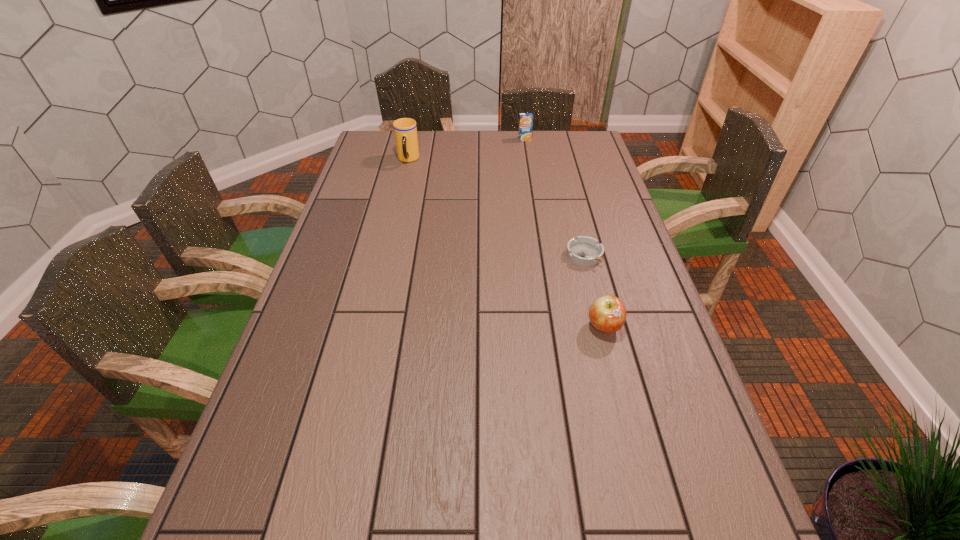
Where is `the tallest object`? This screenshot has width=960, height=540. the tallest object is located at coordinates (405, 129).

Locate an element on the screen. This screenshot has height=540, width=960. the leftmost object is located at coordinates (405, 129).

Find the location of a particular element. The width and height of the screenshot is (960, 540). orange_juice is located at coordinates (525, 119).

Where is `the second object from left to right`? This screenshot has height=540, width=960. the second object from left to right is located at coordinates (525, 119).

Locate an element on the screen. This screenshot has height=540, width=960. the nearest object is located at coordinates (607, 314).

Where is `the third tallest object`? The image size is (960, 540). the third tallest object is located at coordinates (607, 314).

Locate an element on the screen. This screenshot has width=960, height=540. the shortest object is located at coordinates (585, 251).

Where is `the third farthest object`? the third farthest object is located at coordinates (585, 251).

Where is `vacant space located on the side of the cup with the handle`? This screenshot has height=540, width=960. vacant space located on the side of the cup with the handle is located at coordinates (396, 216).

Where is `free space located on the front of the third object from right to left`? The width and height of the screenshot is (960, 540). free space located on the front of the third object from right to left is located at coordinates (532, 187).